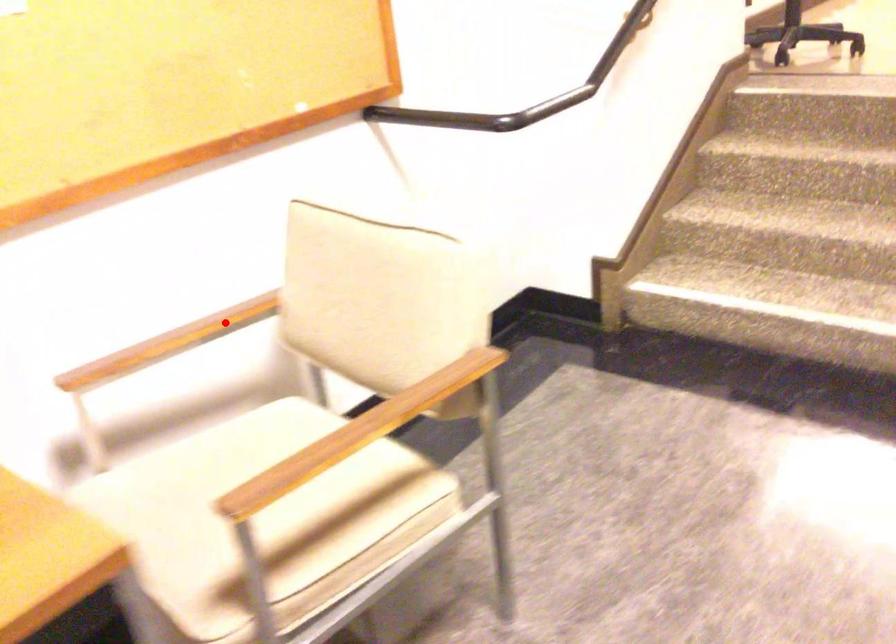
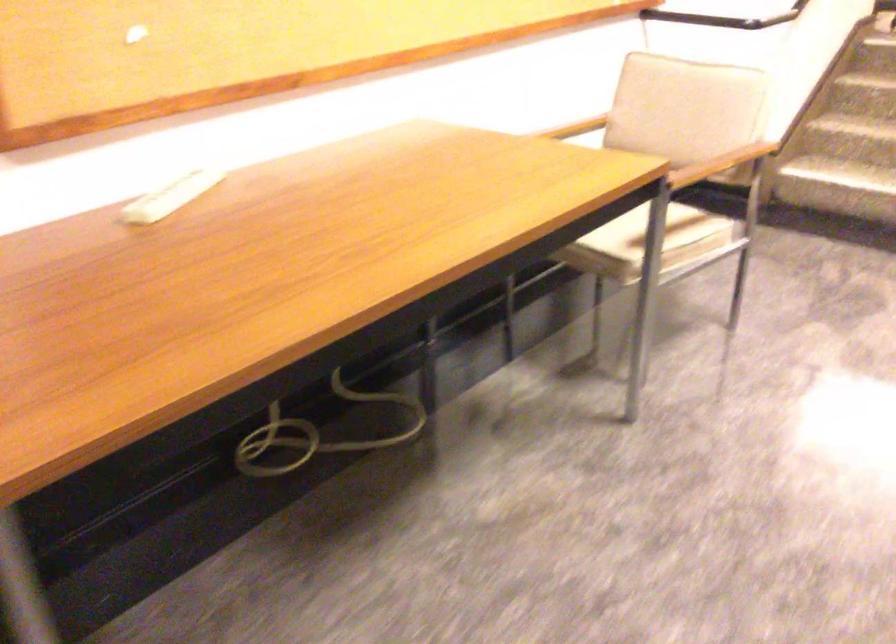
Question: I am providing you with two images of the same scene from different viewpoints. In image1, a red point is highlighted. Considering the same 3D point in image2, which of the following is correct?

Choices:
 (A) It is closer
 (B) It is farther

Answer: (B)